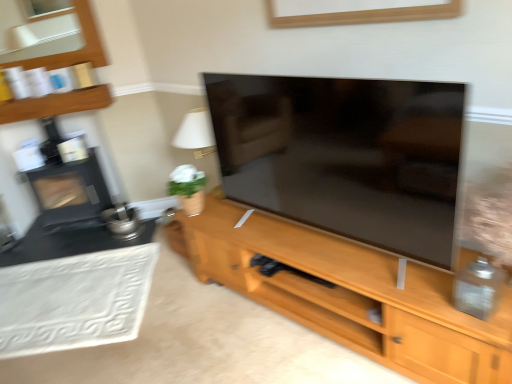
The height and width of the screenshot is (384, 512). What are the coordinates of `free space in front of black matte fireplace at left` in the screenshot? It's located at (68, 239).